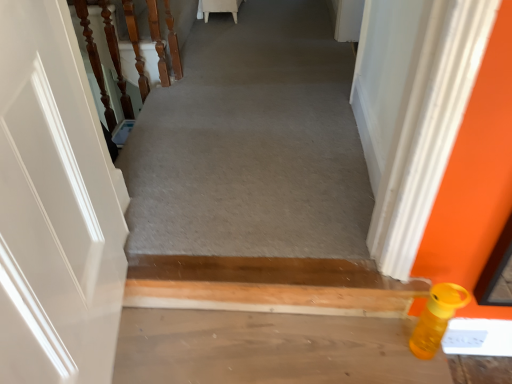
Question: Is wooden balusters at left located outside smooth concrete floor at lower right?

Choices:
 (A) yes
 (B) no

Answer: (A)

Question: Does wooden balusters at left have a larger size compared to smooth concrete floor at lower right?

Choices:
 (A) no
 (B) yes

Answer: (B)

Question: From the image's perspective, would you say wooden balusters at left is positioned over smooth concrete floor at lower right?

Choices:
 (A) yes
 (B) no

Answer: (A)

Question: Is smooth concrete floor at lower right at the back of wooden balusters at left?

Choices:
 (A) yes
 (B) no

Answer: (B)

Question: From a real-world perspective, is wooden balusters at left positioned under smooth concrete floor at lower right based on gravity?

Choices:
 (A) yes
 (B) no

Answer: (B)

Question: From the image's perspective, is matte plastic bottle at lower right positioned above or below smooth concrete floor at lower right?

Choices:
 (A) above
 (B) below

Answer: (A)

Question: Relative to smooth concrete floor at lower right, is matte plastic bottle at lower right in front or behind?

Choices:
 (A) front
 (B) behind

Answer: (B)

Question: In terms of width, does matte plastic bottle at lower right look wider or thinner when compared to smooth concrete floor at lower right?

Choices:
 (A) thin
 (B) wide

Answer: (B)

Question: Choose the correct answer: Is matte plastic bottle at lower right inside smooth concrete floor at lower right or outside it?

Choices:
 (A) outside
 (B) inside

Answer: (A)

Question: Is point (421, 337) positioned closer to the camera than point (93, 46)?

Choices:
 (A) closer
 (B) farther

Answer: (A)

Question: From the image's perspective, is yellow matte bottle at lower right above or below wooden balusters at left?

Choices:
 (A) above
 (B) below

Answer: (B)

Question: From a real-world perspective, relative to wooden balusters at left, is yellow matte bottle at lower right vertically above or below?

Choices:
 (A) below
 (B) above

Answer: (A)

Question: In terms of height, does yellow matte bottle at lower right look taller or shorter compared to wooden balusters at left?

Choices:
 (A) tall
 (B) short

Answer: (B)

Question: Considering the relative positions of smooth concrete floor at lower right and matte plastic bottle at lower right in the image provided, is smooth concrete floor at lower right to the left or to the right of matte plastic bottle at lower right?

Choices:
 (A) left
 (B) right

Answer: (B)

Question: Would you say smooth concrete floor at lower right is inside or outside matte plastic bottle at lower right?

Choices:
 (A) outside
 (B) inside

Answer: (A)